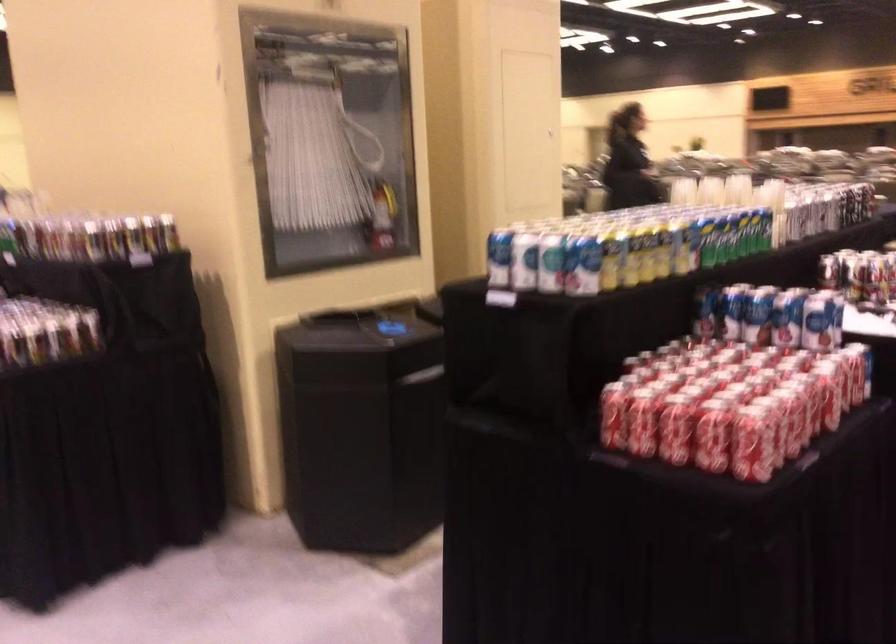
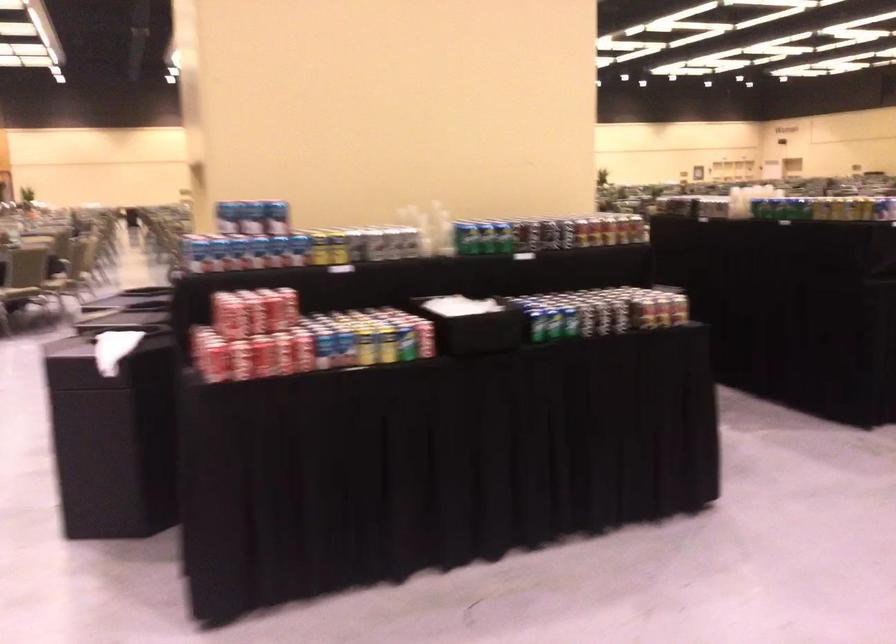
Question: I am providing you with two images of the same scene from different viewpoints. After the viewpoint changes to image2, which objects are now occluded?

Choices:
 (A) green soda can
 (B) red fire extinguisher
 (C) yellow soda can
 (D) metal wire basket

Answer: (B)